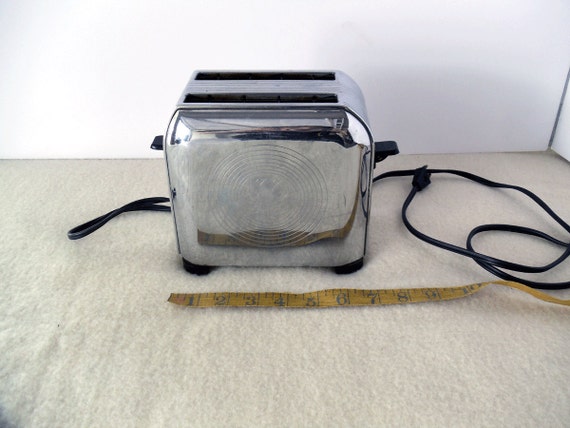
Locate an element on the screen. The width and height of the screenshot is (570, 428). black cord is located at coordinates (157, 210).